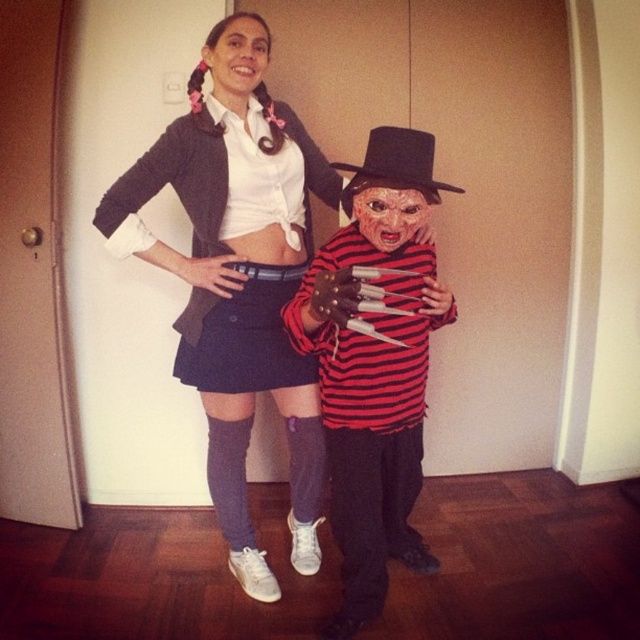
Question: Which object is positioned closest to the matte black jacket at upper center?

Choices:
 (A) smooth plastic mask at center
 (B) smooth skin face at upper center
 (C) red striped shirt at center

Answer: (C)

Question: Among these objects, which one is farthest from the camera?

Choices:
 (A) red striped shirt at center
 (B) matte black jacket at upper center
 (C) smooth plastic mask at center
 (D) smooth skin face at upper center

Answer: (D)

Question: Is matte black jacket at upper center above smooth skin face at upper center?

Choices:
 (A) yes
 (B) no

Answer: (B)

Question: Does matte black jacket at upper center appear on the left side of smooth plastic mask at center?

Choices:
 (A) yes
 (B) no

Answer: (A)

Question: Estimate the real-world distances between objects in this image. Which object is farther from the red striped shirt at center?

Choices:
 (A) smooth plastic mask at center
 (B) matte black jacket at upper center
 (C) smooth skin face at upper center

Answer: (C)

Question: Is matte black jacket at upper center to the left of smooth skin face at upper center from the viewer's perspective?

Choices:
 (A) no
 (B) yes

Answer: (A)